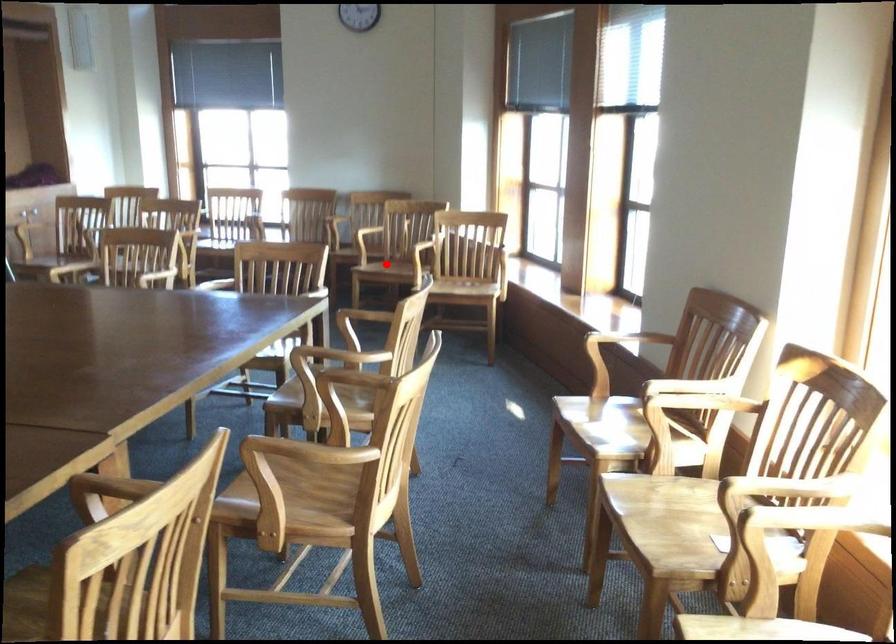
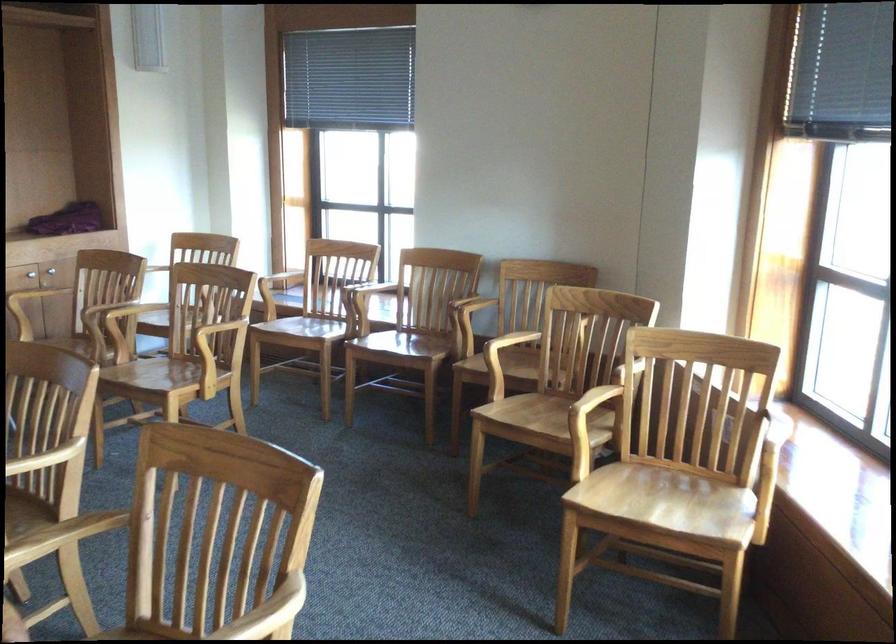
The point at the highlighted location is marked in the first image. Where is the corresponding point in the second image?

(547, 418)